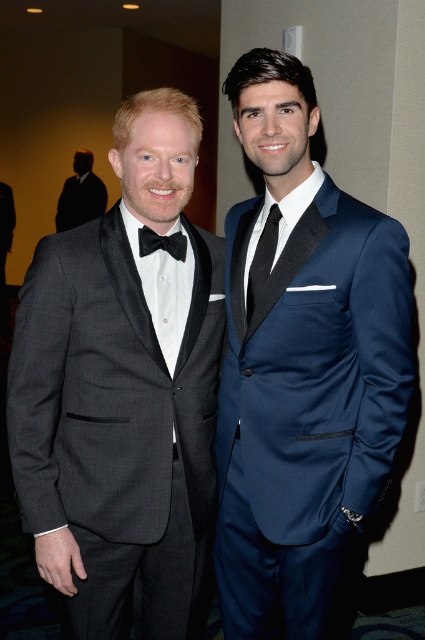
Does dark suit at left have a lesser height compared to black satin bow tie at center?

No, dark suit at left is not shorter than black satin bow tie at center.

Who is positioned more to the right, dark suit at left or black satin bow tie at center?

Positioned to the right is black satin bow tie at center.

Which is behind, point (59, 227) or point (150, 241)?

Positioned behind is point (59, 227).

What are the coordinates of `dark suit at left` in the screenshot? It's located at (81, 195).

Does point (144, 540) come closer to viewer compared to point (252, 336)?

Yes.

From the picture: Is matte black tuxedo at left above navy satin suit at center?

No, matte black tuxedo at left is not above navy satin suit at center.

Is point (197, 557) in front of point (274, 573)?

Yes, it is.

Locate an element on the screen. The width and height of the screenshot is (425, 640). matte black tuxedo at left is located at coordinates (124, 394).

Does navy satin suit at center have a lesser height compared to black satin bow tie at center?

No.

Who is lower down, navy satin suit at center or black satin bow tie at center?

navy satin suit at center is below.

The width and height of the screenshot is (425, 640). What do you see at coordinates (303, 369) in the screenshot? I see `navy satin suit at center` at bounding box center [303, 369].

The height and width of the screenshot is (640, 425). Find the location of `navy satin suit at center`. navy satin suit at center is located at coordinates (303, 369).